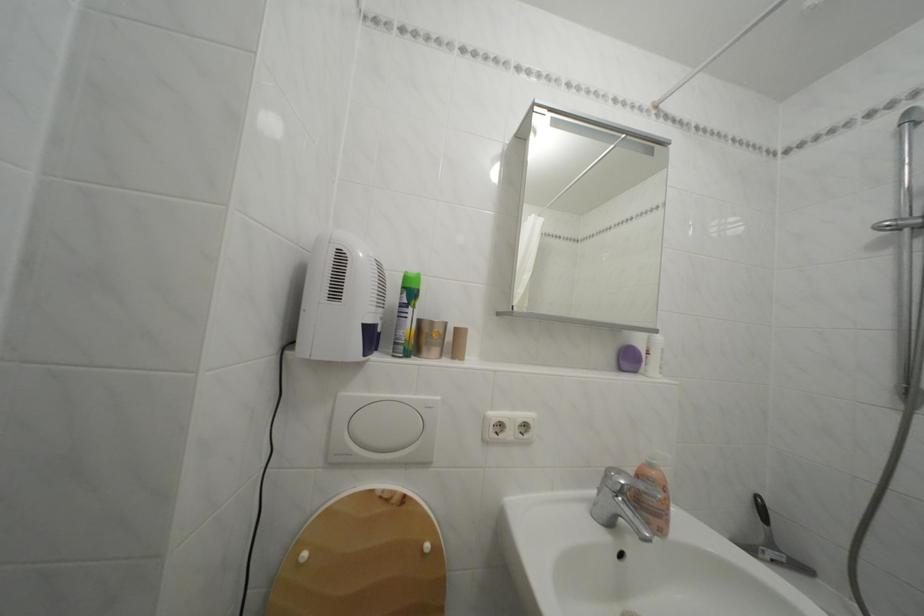
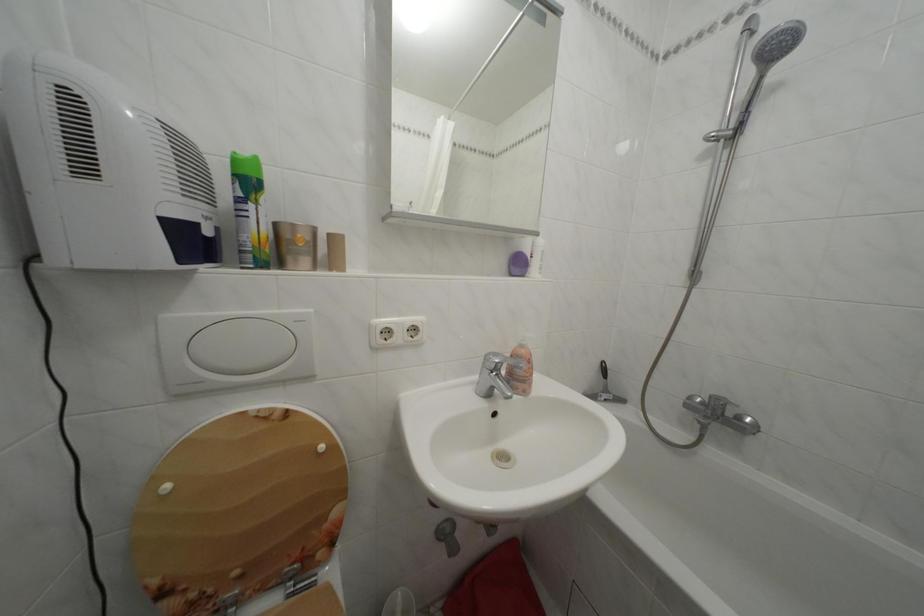
Question: I am providing you with two images of the same scene from different viewpoints. Which of the following objects are not visible in image2?

Choices:
 (A) soap dispenser pump
 (B) sink faucet handle
 (C) purple soap container
 (D) none of these

Answer: (D)